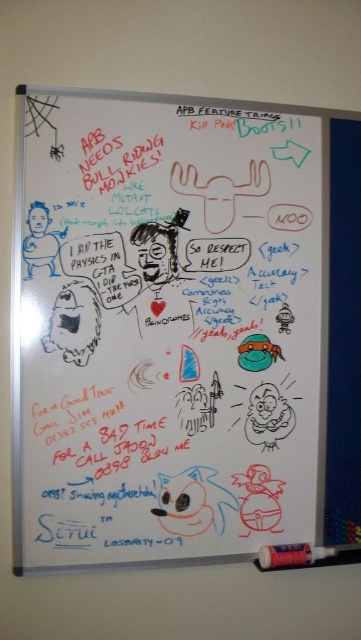
You are standing 1 meter away from the whiteboard. There is a point marked at coordinates [127,189] on the board. Can you reach this point with your hand if you extend it fully?

The distance of point [127,189] from viewer is 1.11 meters. Since you are standing 1 meter away, the point is 0.11 meters further away than your reach. You cannot reach it without moving closer.

Based on the photo, you are standing in front of the whiteboard and notice two points marked on it. Which of the two points, point [219,554] or point [318,547], appears closer to you?

Point [219,554] is closer to the camera than point [318,547], so it appears closer to you.

In the scene shown: You are an artist standing in front of the whiteboard at upper center and the matte plastic crayon at bottom right. You need to reach for the crayon first. Which object is lower in position?

The matte plastic crayon at bottom right is lower than the whiteboard at upper center, so you should reach for it first.